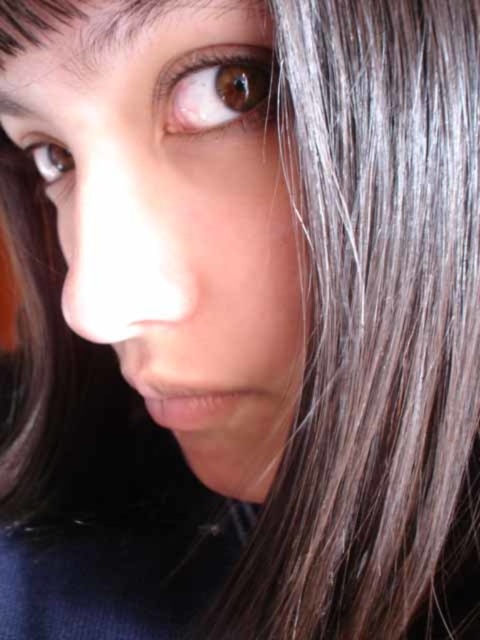
You are a photographer adjusting the focus on your camera. You want to ensure that both the point at coordinates point [264,124] and the point at coordinates point [60,156] are in focus. Given that the depth of field can only sharply focus on one plane, which point should you prioritize focusing on to ensure the most critical part of the subject is sharp?

You should prioritize focusing on point [264,124] because it is closer to the camera than point [60,156], making it the more critical part of the subject to keep sharp.

You are a photographer adjusting the lighting for a portrait. You notice the brown matte eye at upper center and the brown glossy eye at upper left. To ensure both eyes are equally illuminated, how far apart are they?

The distance between the brown matte eye at upper center and the brown glossy eye at upper left is 11.74 centimeters, so you should adjust the lighting to account for this distance to ensure both eyes are equally illuminated.